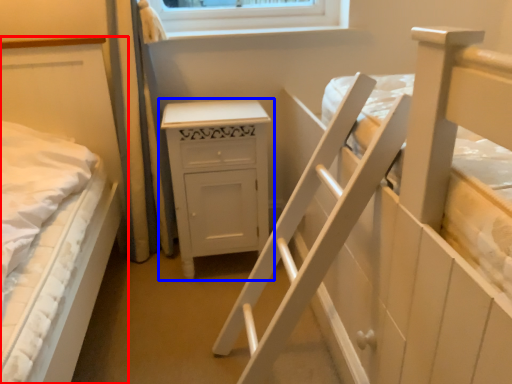
Question: Which of the following is the farthest to the observer, bed (highlighted by a red box) or chest of drawers (highlighted by a blue box)?

Choices:
 (A) bed
 (B) chest of drawers

Answer: (B)